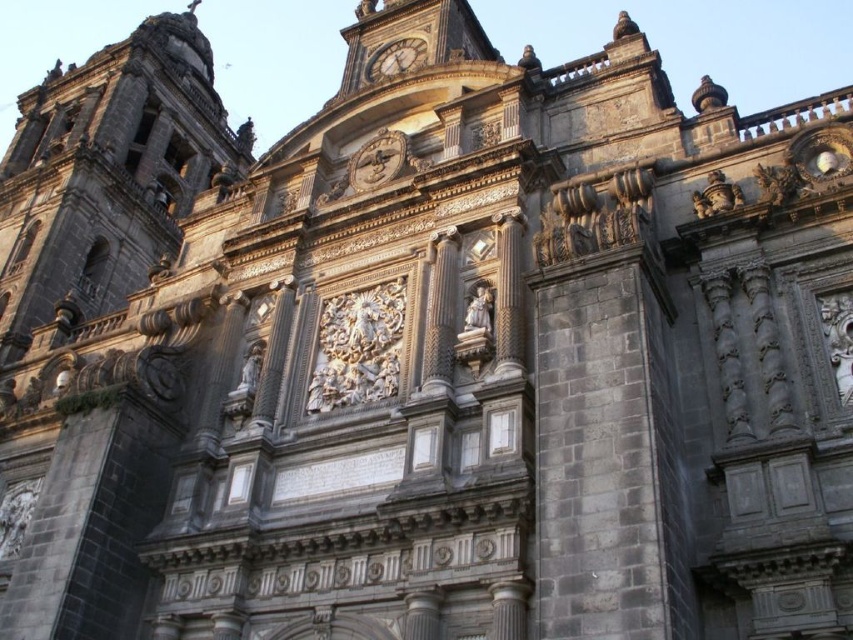
This screenshot has width=853, height=640. I want to click on gold metallic clock at center, so click(376, 161).

Which is behind, point (374, 141) or point (386, 52)?

Positioned behind is point (386, 52).

You are a GUI agent. You are given a task and a screenshot of the screen. Output one action in this format:
    pyautogui.click(x=<x>, y=<y>)
    Task: Click on the gold metallic clock at center
    This screenshot has height=640, width=853.
    Given the screenshot: What is the action you would take?
    pyautogui.click(x=376, y=161)